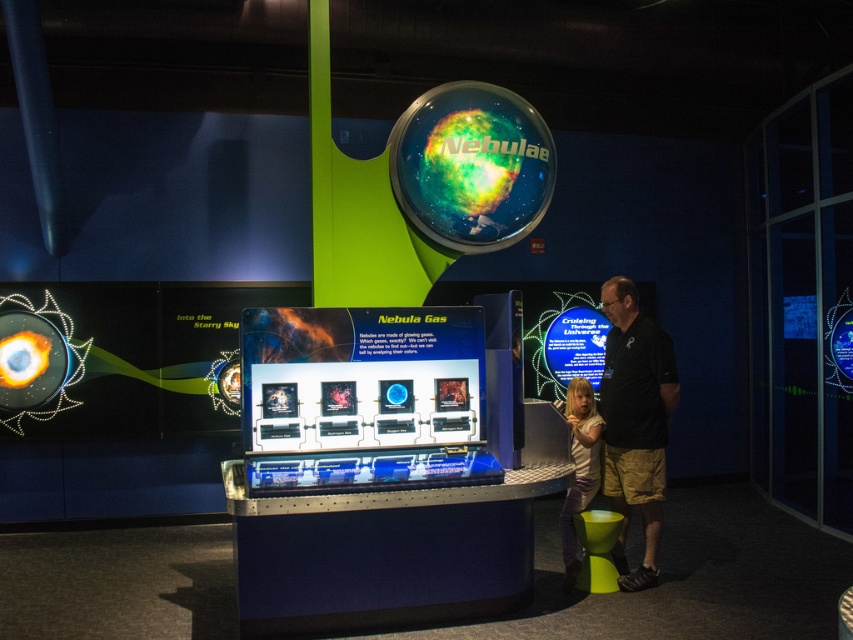
You are a visitor at the science museum exhibit about nebulae. You notice two items in the foreground near the display panels. One is the black cotton shirt at right and the other is the light brown hair at lower right. Which of these two items is bigger in size?

The black cotton shirt at right is larger in size than the light brown hair at lower right.